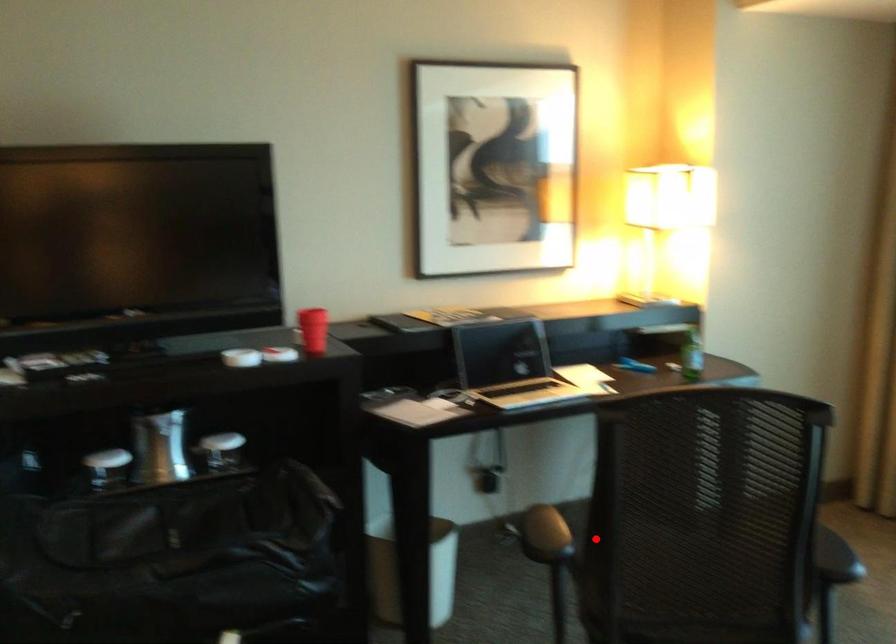
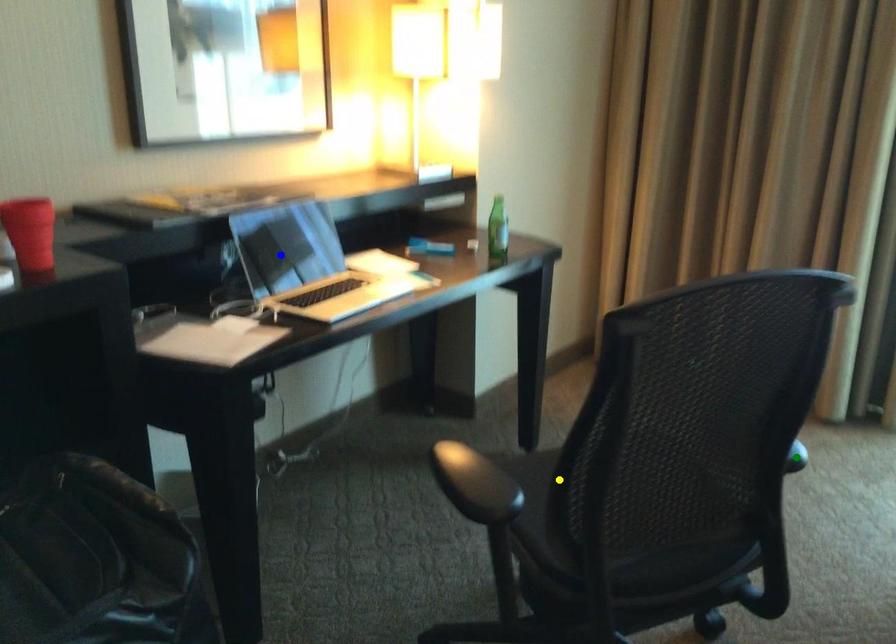
Question: I am providing you with two images of the same scene from different viewpoints. A red point is marked on the first image. You are given multiple points on the second image. Which point in image 2 is actually the same real-world point as the red point in image 1?

Choices:
 (A) yellow point
 (B) blue point
 (C) green point

Answer: (A)